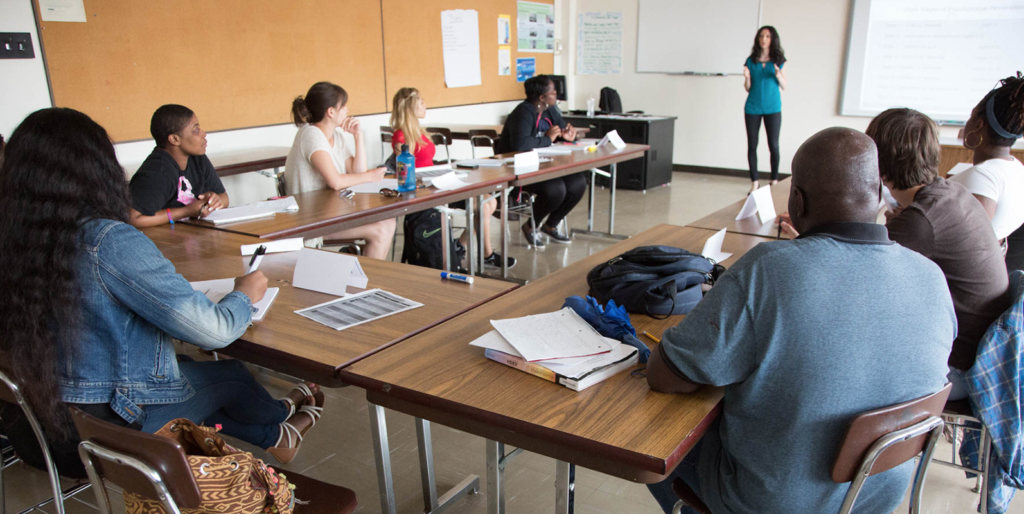
This screenshot has height=514, width=1024. I want to click on dry erase markers, so click(689, 75), click(717, 75), click(449, 270).